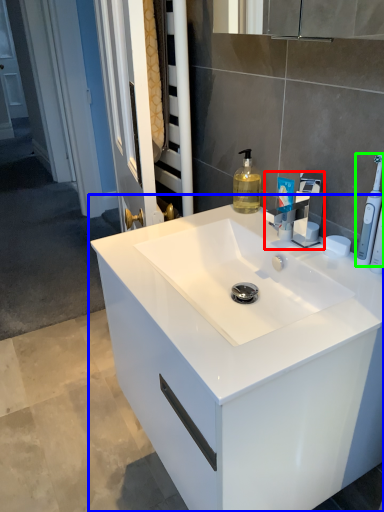
Question: Which is nearer to the tap (highlighted by a red box)? bathroom cabinet (highlighted by a blue box) or toothbrush (highlighted by a green box).

Choices:
 (A) bathroom cabinet
 (B) toothbrush

Answer: (B)